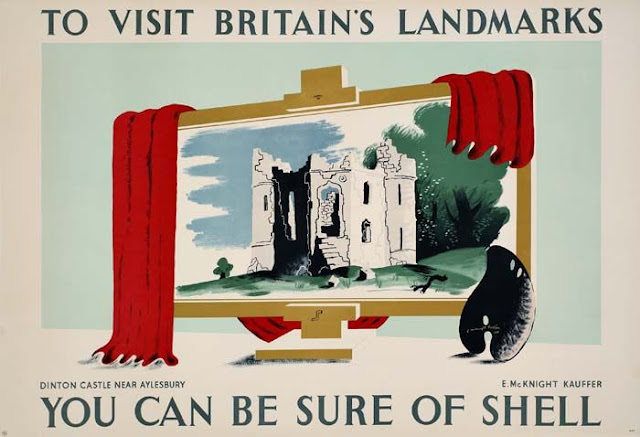
Where is `curtain`? curtain is located at coordinates (141, 205), (493, 106).